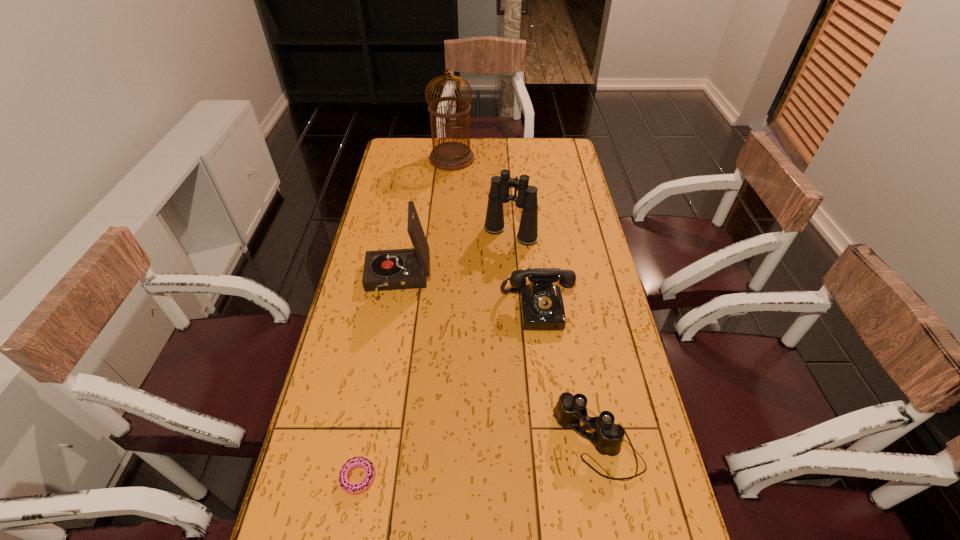
You are a GUI agent. You are given a task and a screenshot of the screen. Output one action in this format:
    pyautogui.click(x=<x>, y=<y>)
    Task: Click on the vacant region located on the left of the taller binoculars
    
    Given the screenshot: What is the action you would take?
    pyautogui.click(x=433, y=233)

What are the coordinates of `vacant space located on the back of the phonograph record` in the screenshot? It's located at (413, 197).

Image resolution: width=960 pixels, height=540 pixels. I want to click on free space located 0.340m on the dial of the third shortest object, so click(552, 442).

The height and width of the screenshot is (540, 960). I want to click on free space located 0.340m on the left of the shorter binoculars, so click(420, 443).

At what (x,y) coordinates should I click in order to perform the action: click on free spot located 0.300m on the right of the shortest object. Please return your answer as a coordinate pair (x, y). Looking at the image, I should click on (504, 477).

You are a GUI agent. You are given a task and a screenshot of the screen. Output one action in this format:
    pyautogui.click(x=<x>, y=<y>)
    Task: Click on the object present at the far edge
    
    Given the screenshot: What is the action you would take?
    pyautogui.click(x=450, y=156)

The width and height of the screenshot is (960, 540). In order to click on phonograph record that is at the left edge in this screenshot , I will do `click(396, 269)`.

Locate an element on the screen. The height and width of the screenshot is (540, 960). doughnut located at the left edge is located at coordinates (351, 488).

Identify the location of telephone at the right edge. This screenshot has width=960, height=540. (542, 308).

You are a GUI agent. You are given a task and a screenshot of the screen. Output one action in this format:
    pyautogui.click(x=<x>, y=<y>)
    Task: Click on the binoculars positioned at the right edge
    The height and width of the screenshot is (540, 960).
    Given the screenshot: What is the action you would take?
    pyautogui.click(x=607, y=437)